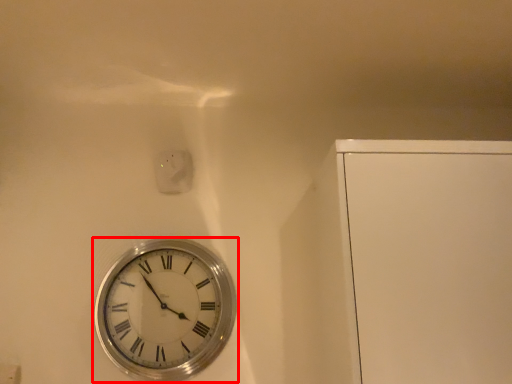
Question: From the image's perspective, what is the correct spatial positioning of wall clock (annotated by the red box) in reference to electric outlet?

Choices:
 (A) above
 (B) below

Answer: (B)